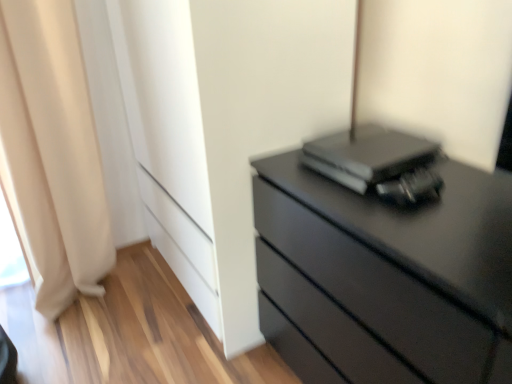
Question: Does beige fabric curtain at left appear on the left side of black matte computer at upper right?

Choices:
 (A) yes
 (B) no

Answer: (A)

Question: Can you confirm if beige fabric curtain at left is wider than black matte computer at upper right?

Choices:
 (A) no
 (B) yes

Answer: (B)

Question: From the image's perspective, is beige fabric curtain at left over black matte computer at upper right?

Choices:
 (A) yes
 (B) no

Answer: (A)

Question: Is beige fabric curtain at left smaller than black matte computer at upper right?

Choices:
 (A) no
 (B) yes

Answer: (A)

Question: Can you confirm if beige fabric curtain at left is positioned to the right of black matte computer at upper right?

Choices:
 (A) yes
 (B) no

Answer: (B)

Question: From a real-world perspective, is beige fabric curtain at left positioned above or below matte black chest of drawers at right?

Choices:
 (A) below
 (B) above

Answer: (B)

Question: Is point (70, 26) positioned closer to the camera than point (403, 240)?

Choices:
 (A) farther
 (B) closer

Answer: (A)

Question: From the image's perspective, is beige fabric curtain at left above or below matte black chest of drawers at right?

Choices:
 (A) below
 (B) above

Answer: (B)

Question: Looking at the image, does beige fabric curtain at left seem bigger or smaller compared to matte black chest of drawers at right?

Choices:
 (A) small
 (B) big

Answer: (A)

Question: Is black matte computer at upper right wider or thinner than beige fabric curtain at left?

Choices:
 (A) wide
 (B) thin

Answer: (B)

Question: From the image's perspective, is black matte computer at upper right positioned above or below beige fabric curtain at left?

Choices:
 (A) above
 (B) below

Answer: (B)

Question: From their relative heights in the image, would you say black matte computer at upper right is taller or shorter than beige fabric curtain at left?

Choices:
 (A) tall
 (B) short

Answer: (B)

Question: From a real-world perspective, is black matte computer at upper right physically located above or below beige fabric curtain at left?

Choices:
 (A) above
 (B) below

Answer: (A)

Question: Considering the positions of beige fabric curtain at left and black matte computer at upper right in the image, is beige fabric curtain at left taller or shorter than black matte computer at upper right?

Choices:
 (A) short
 (B) tall

Answer: (B)

Question: From a real-world perspective, is beige fabric curtain at left above or below black matte computer at upper right?

Choices:
 (A) below
 (B) above

Answer: (A)